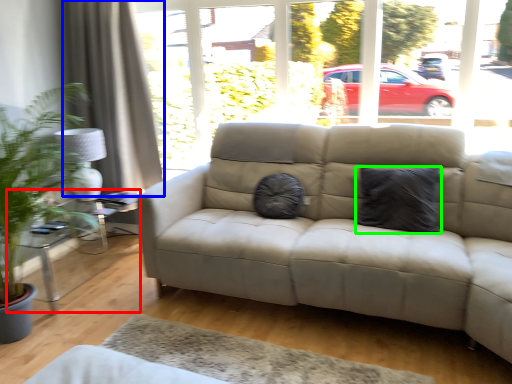
Question: Which object is the farthest from table (highlighted by a red box)? Choose among these: curtain (highlighted by a blue box) or pillow (highlighted by a green box).

Choices:
 (A) curtain
 (B) pillow

Answer: (B)